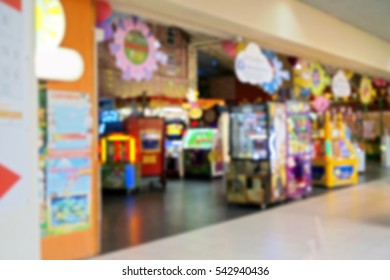
Where is `ceiling`? ceiling is located at coordinates (370, 20).